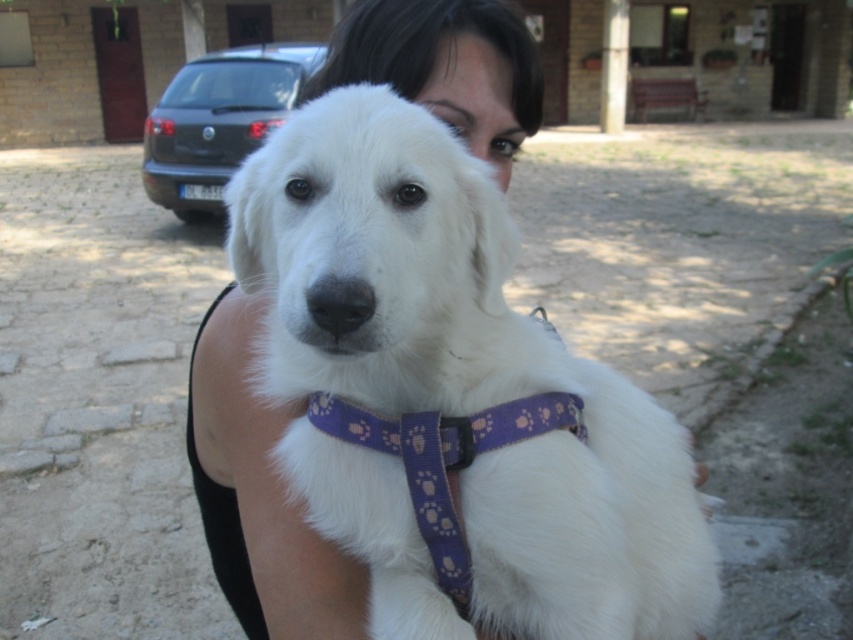
Who is lower down, white fabric dog at center or purple fabric neckband at center?

purple fabric neckband at center is lower down.

Is white fabric dog at center taller than purple fabric neckband at center?

Yes, white fabric dog at center is taller than purple fabric neckband at center.

Is point (489, 282) closer to camera compared to point (329, 420)?

Yes.

This screenshot has height=640, width=853. What are the coordinates of `white fabric dog at center` in the screenshot? It's located at (453, 388).